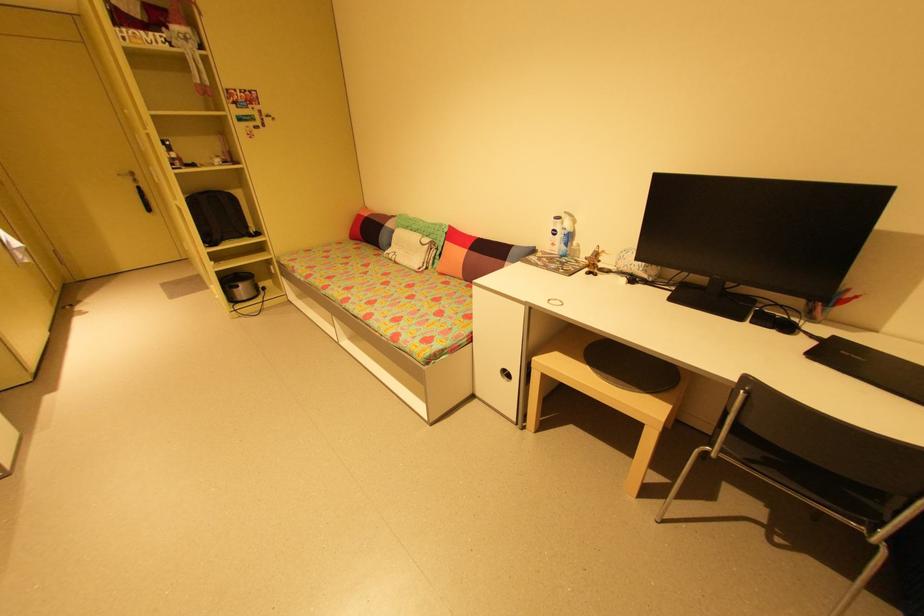
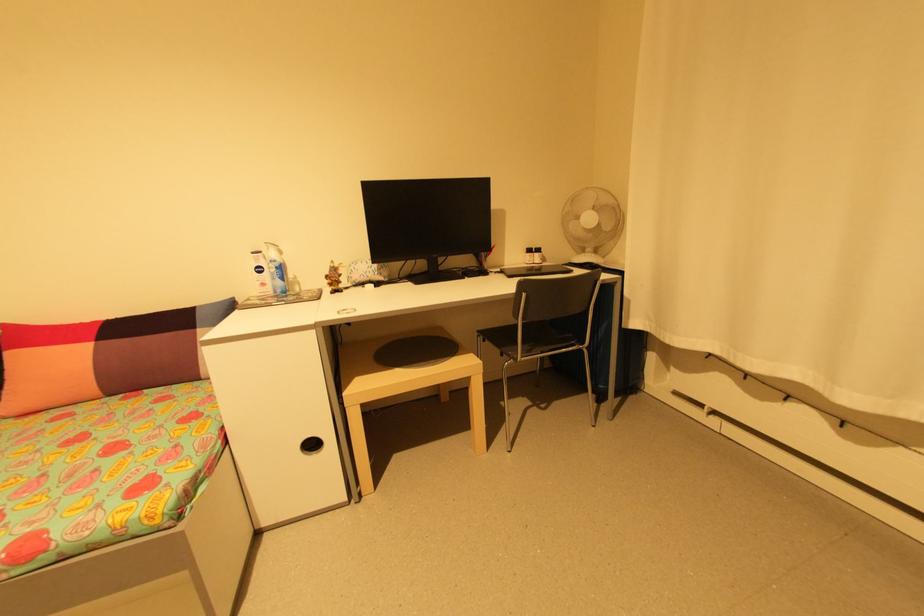
Where in the second image is the point corresponding to pixel 468 282 from the first image?

(111, 399)